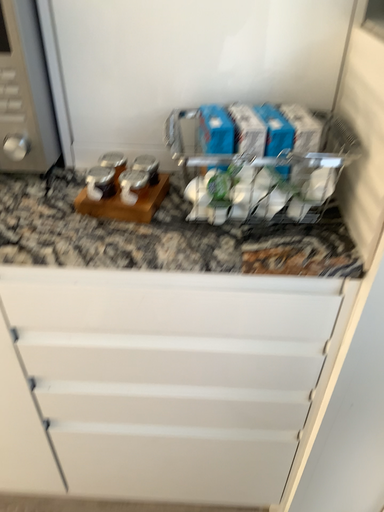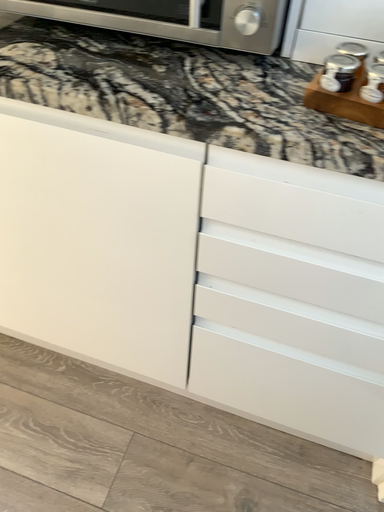
Question: How did the camera likely rotate when shooting the video?

Choices:
 (A) rotated left
 (B) rotated right

Answer: (A)